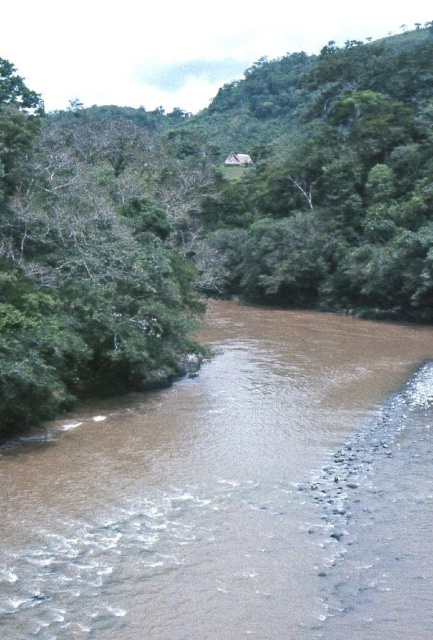
Can you confirm if brown muddy water at center is wider than green leafy tree at left?

Incorrect, brown muddy water at center's width does not surpass green leafy tree at left's.

Does brown muddy water at center appear on the right side of green leafy tree at left?

Yes, brown muddy water at center is to the right of green leafy tree at left.

Does point (414, 621) lie in front of point (18, 273)?

Yes.

Locate an element on the screen. The image size is (433, 640). brown muddy water at center is located at coordinates (235, 493).

The width and height of the screenshot is (433, 640). What are the coordinates of `brown muddy water at center` in the screenshot? It's located at (235, 493).

Is brown muddy water at center bigger than green leafy tree at center?

No, brown muddy water at center is not bigger than green leafy tree at center.

Does point (3, 577) lie behind point (55, 404)?

No, (3, 577) is in front of (55, 404).

Find the location of a particular element. This screenshot has width=433, height=640. brown muddy water at center is located at coordinates (235, 493).

Is green leafy tree at center thinner than green leafy tree at left?

No, green leafy tree at center is not thinner than green leafy tree at left.

Does point (388, 225) come in front of point (93, 289)?

That is False.

This screenshot has width=433, height=640. In order to click on green leafy tree at center in this screenshot , I will do `click(209, 216)`.